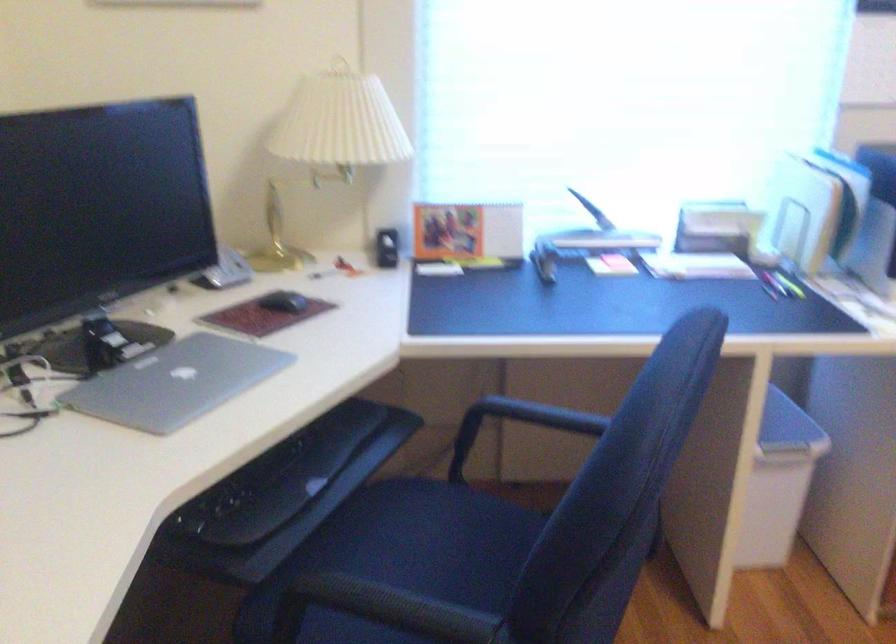
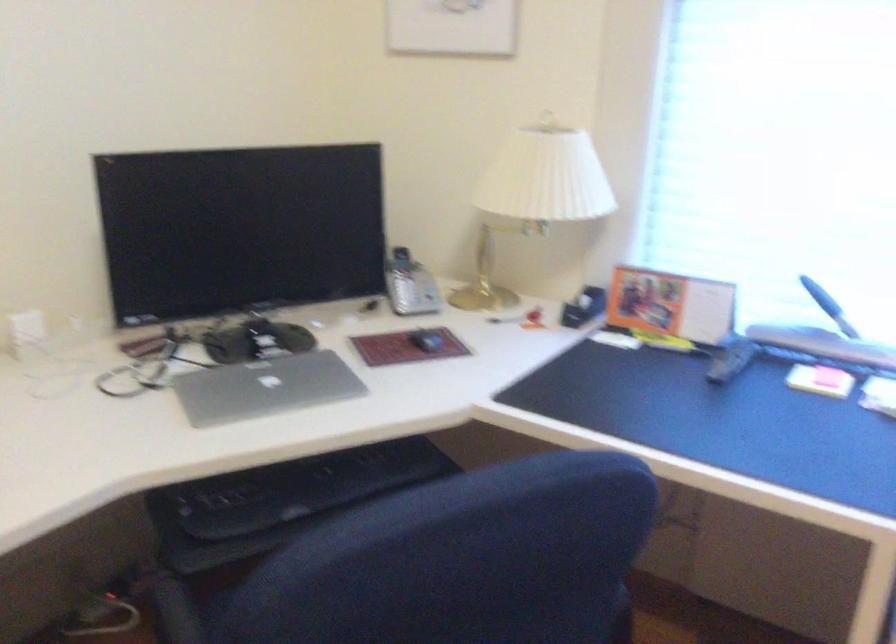
The point at (x=472, y=231) is marked in the first image. Where is the corresponding point in the second image?

(670, 305)